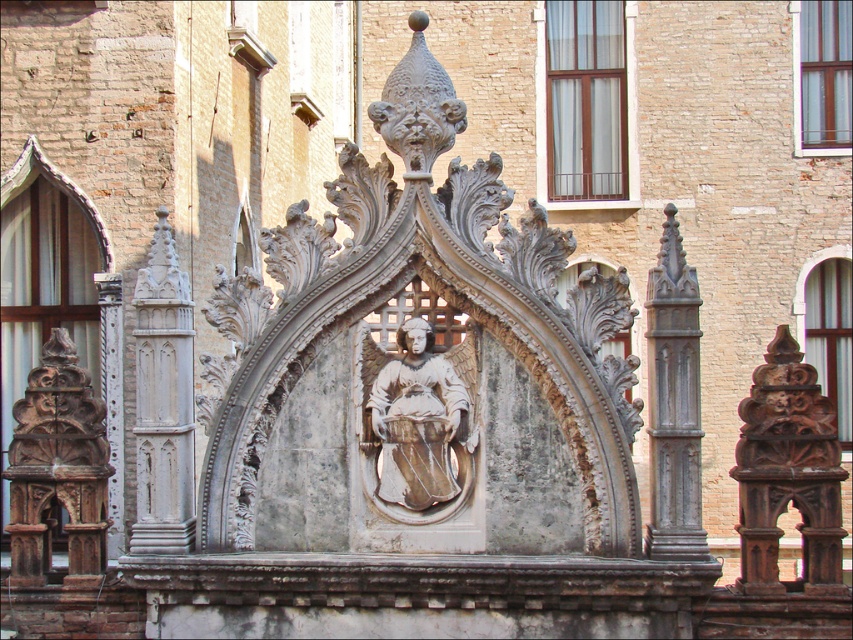
Is white stone sculpture at center to the left of white stone angel at center from the viewer's perspective?

No, white stone sculpture at center is not to the left of white stone angel at center.

Measure the distance between white stone sculpture at center and camera.

white stone sculpture at center is 44.21 meters away from camera.

Describe the element at coordinates (413, 348) in the screenshot. I see `white stone sculpture at center` at that location.

Locate an element on the screen. The image size is (853, 640). white stone sculpture at center is located at coordinates (413, 348).

In the scene shown: Which is more to the left, white stone sculpture at center or carved wood column at left?

Positioned to the left is carved wood column at left.

Does white stone sculpture at center lie behind carved wood column at left?

That is False.

Where is `white stone sculpture at center`? white stone sculpture at center is located at coordinates (413, 348).

The height and width of the screenshot is (640, 853). What are the coordinates of `white stone sculpture at center` in the screenshot? It's located at (413, 348).

Between white stone sculpture at center and white stone column at left, which one is positioned lower?

Positioned lower is white stone sculpture at center.

Does white stone sculpture at center have a greater width compared to white stone column at left?

Yes.

Who is more distant from viewer, (392, 134) or (170, 381)?

Point (170, 381)

The height and width of the screenshot is (640, 853). In order to click on white stone sculpture at center in this screenshot , I will do `click(413, 348)`.